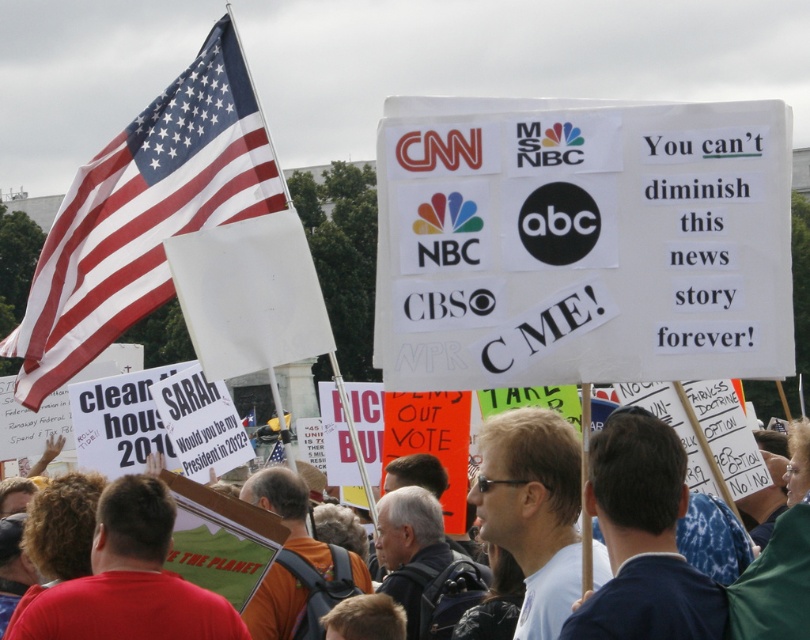
Between point (518, 145) and point (194, 179), which one is positioned in front?

Point (518, 145) is in front.

Is point (676, 216) positioned behind point (71, 234)?

No, it is not.

What are the coordinates of `white paper sign at center` in the screenshot? It's located at (582, 243).

At what (x,y) coordinates should I click in order to perform the action: click on white paper sign at center. Please return your answer as a coordinate pair (x, y). The image size is (810, 640). Looking at the image, I should click on (582, 243).

Which is in front, point (244, 128) or point (685, 564)?

Point (685, 564) is in front.

Who is shorter, red-white striped fabric flag at left or white cardboard sign at center?

With less height is white cardboard sign at center.

Who is more forward, (41, 384) or (655, 625)?

Positioned in front is point (655, 625).

At what (x,y) coordinates should I click in order to perform the action: click on red-white striped fabric flag at left. Please return your answer as a coordinate pair (x, y). Looking at the image, I should click on [x=143, y=212].

Can you confirm if red-white striped fabric flag at left is bigger than blue fabric shirt at center?

Indeed, red-white striped fabric flag at left has a larger size compared to blue fabric shirt at center.

In the scene shown: Which is below, red-white striped fabric flag at left or blue fabric shirt at center?

Positioned lower is blue fabric shirt at center.

Identify the location of red-white striped fabric flag at left. This screenshot has height=640, width=810. (143, 212).